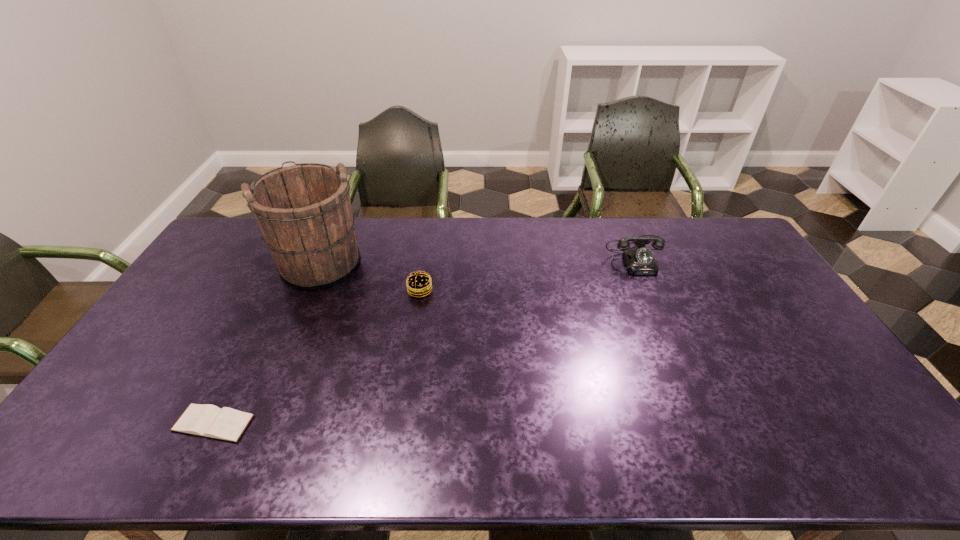
You are a GUI agent. You are given a task and a screenshot of the screen. Output one action in this format:
    pyautogui.click(x=<x>, y=<y>)
    Task: Click on the vacant space located on the right of the shortest object
    The image size is (960, 540).
    Given the screenshot: What is the action you would take?
    pyautogui.click(x=329, y=423)

You are a GUI agent. You are given a task and a screenshot of the screen. Output one action in this format:
    pyautogui.click(x=<x>, y=<y>)
    Task: Click on the bucket located in the far edge section of the desktop
    
    Given the screenshot: What is the action you would take?
    pyautogui.click(x=304, y=212)

I want to click on telephone that is at the far edge, so click(639, 260).

Where is `object that is at the near edge`? object that is at the near edge is located at coordinates (206, 420).

The width and height of the screenshot is (960, 540). Identify the location of free region at the far edge of the desktop. (565, 221).

You are a GUI agent. You are given a task and a screenshot of the screen. Output one action in this format:
    pyautogui.click(x=<x>, y=<y>)
    Task: Click on the vacant space at the near edge
    The height and width of the screenshot is (540, 960).
    Given the screenshot: What is the action you would take?
    pyautogui.click(x=409, y=449)

I want to click on blank space at the right edge of the desktop, so click(784, 349).

Locate an element on the screen. The width and height of the screenshot is (960, 540). free space at the far right corner of the desktop is located at coordinates (707, 228).

The height and width of the screenshot is (540, 960). Identify the location of empty space between the rightmost object and the second shortest object. (529, 272).

Locate an element on the screen. This screenshot has height=540, width=960. free space between the shortest object and the bucket is located at coordinates coord(267,342).